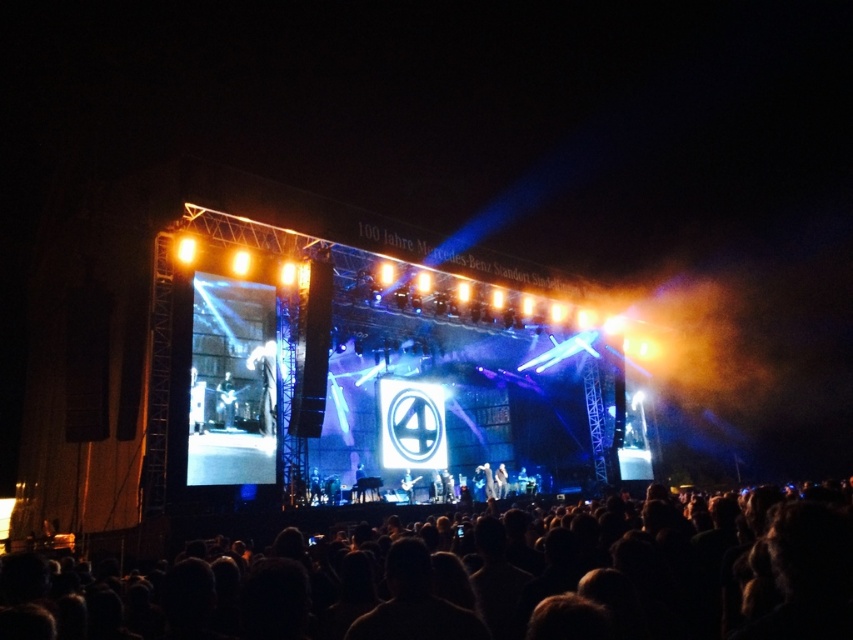
Based on the photo, can you confirm if black matte crowd at lower center is wider than shiny black guitar at center?

Indeed, black matte crowd at lower center has a greater width compared to shiny black guitar at center.

Who is more distant from viewer, (363,634) or (231,392)?

Positioned behind is point (231,392).

Does point (0, 611) lie behind point (224, 417)?

No, it is not.

Find the location of a particular element. black matte crowd at lower center is located at coordinates (479, 577).

Is point (195, 637) positioned before point (248, 365)?

Yes.

Identify the location of black matte crowd at lower center. This screenshot has height=640, width=853. (479, 577).

Can you confirm if dark fabric jacket at center is positioned below shiny black guitar at center?

Actually, dark fabric jacket at center is above shiny black guitar at center.

Does dark fabric jacket at center appear on the right side of shiny black guitar at center?

Correct, you'll find dark fabric jacket at center to the right of shiny black guitar at center.

In the scene shown: Who is more forward, (252, 353) or (229, 372)?

Point (229, 372) is in front.

Locate an element on the screen. The height and width of the screenshot is (640, 853). dark fabric jacket at center is located at coordinates (265, 385).